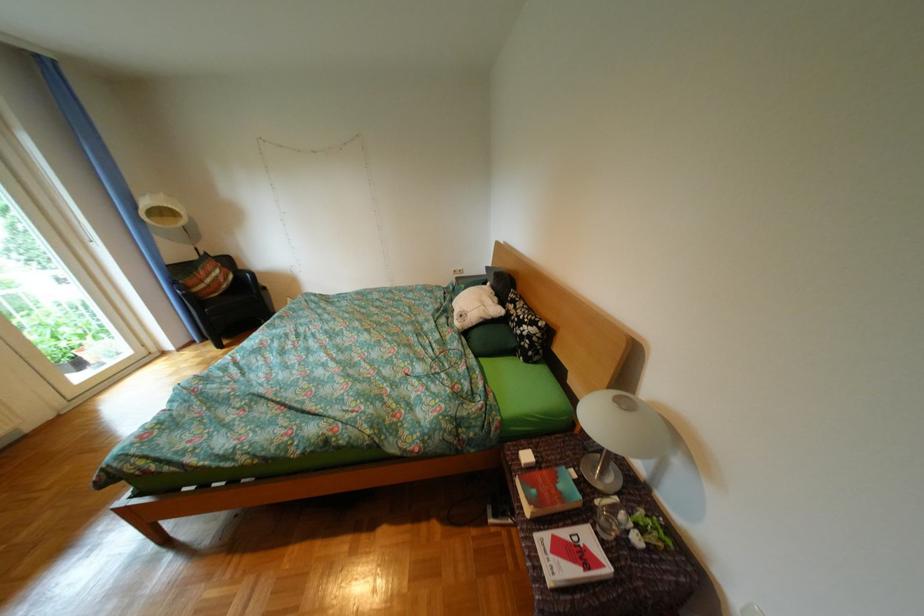
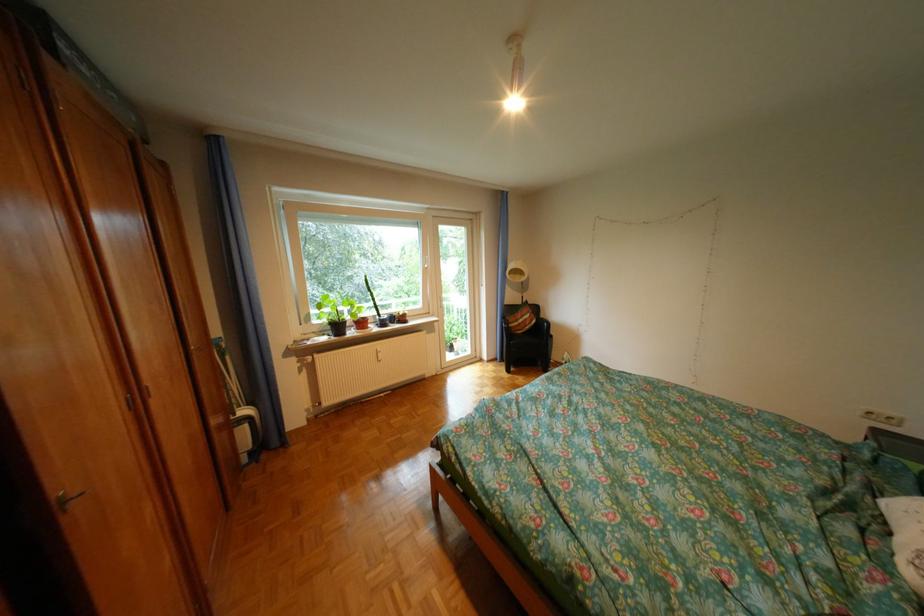
Question: The images are taken continuously from a first-person perspective. In which direction is your viewpoint rotating?

Choices:
 (A) Left
 (B) Right
 (C) Up
 (D) Down

Answer: (A)